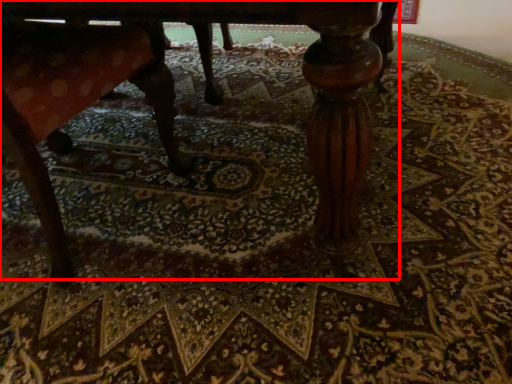
Question: In this image, where is table (annotated by the red box) located relative to rocking chair?

Choices:
 (A) right
 (B) left

Answer: (A)